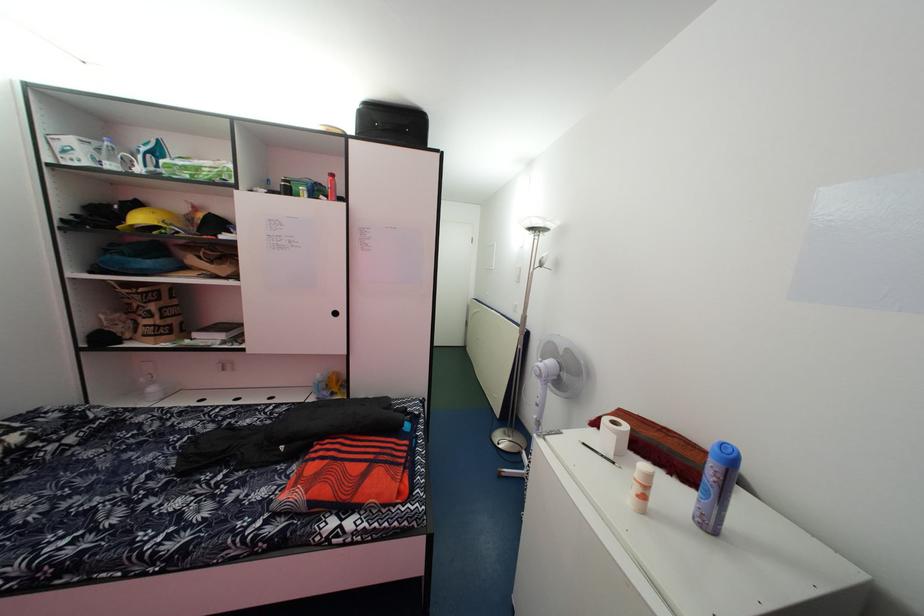
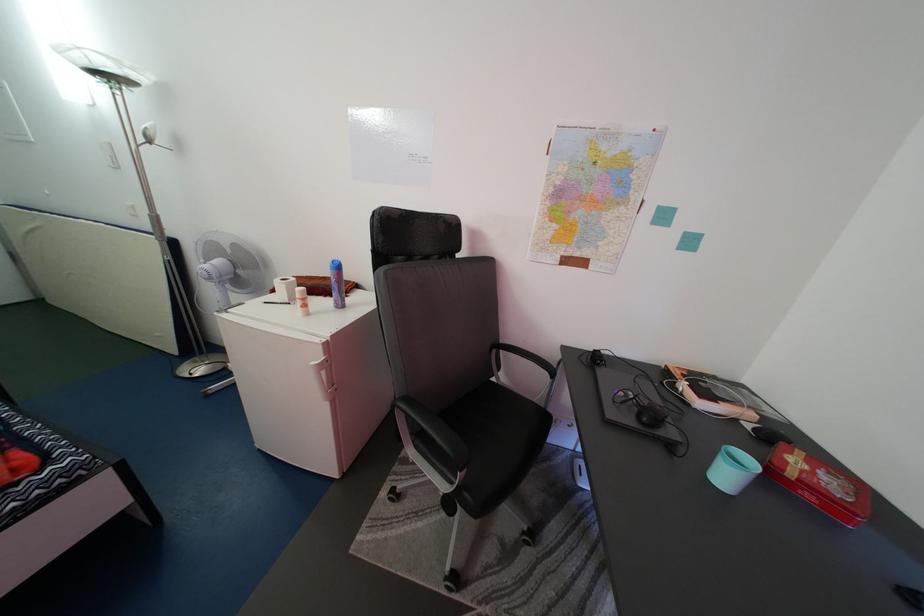
Find the pixel in the second image that matches [646,495] in the first image.

(308, 310)